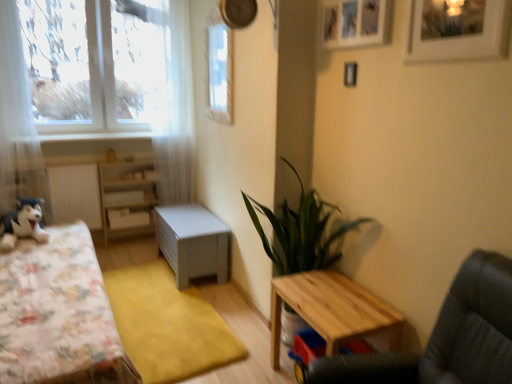
Locate an element on the screen. The image size is (512, 384). free space above yellow carpet at center (from a real-world perspective) is located at coordinates (165, 299).